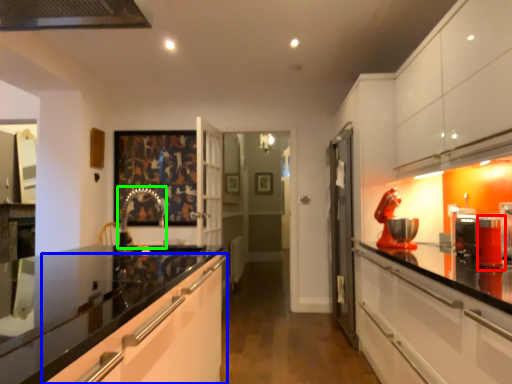
Question: Which is nearer to the appliance (highlighted by a red box)? cabinetry (highlighted by a blue box) or faucet (highlighted by a green box).

Choices:
 (A) cabinetry
 (B) faucet

Answer: (A)